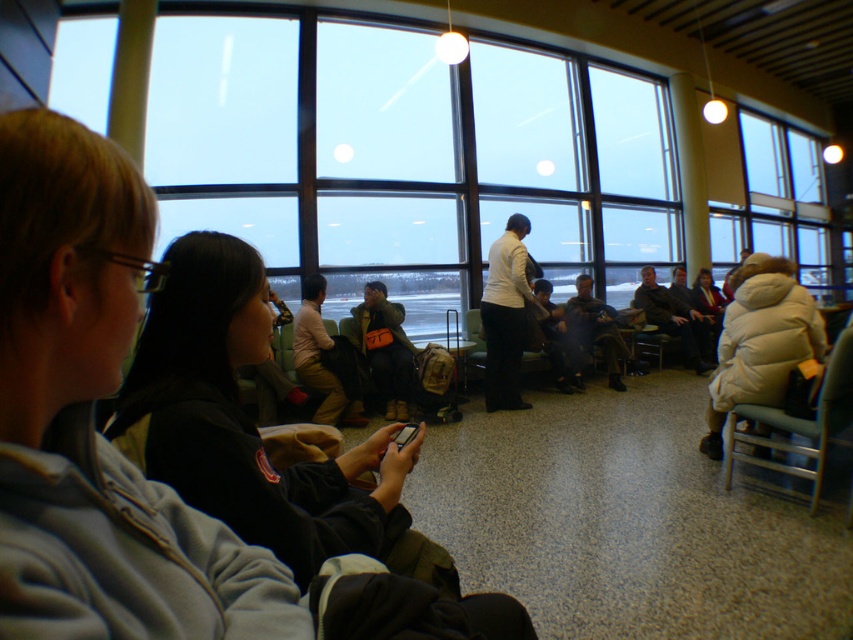
You are a traveler who just arrived at the airport and wants to sit down. You see a light beige fabric chair at right and a white matte jacket at center. Which object is closer to the floor?

The light beige fabric chair at right is closer to the floor because it is below the white matte jacket at center.

You are standing in the airport terminal and need to reach the light beige fabric chair at right. Considering your height is 1.7 meters, will you be able to see the snowy landscape outside the large windows through the terminal from the chair?

The light beige fabric chair at right is 2.43 meters away from you. Since the chair is within a typical terminal seating arrangement and the windows are large, you will be able to see the snowy landscape outside from the chair.